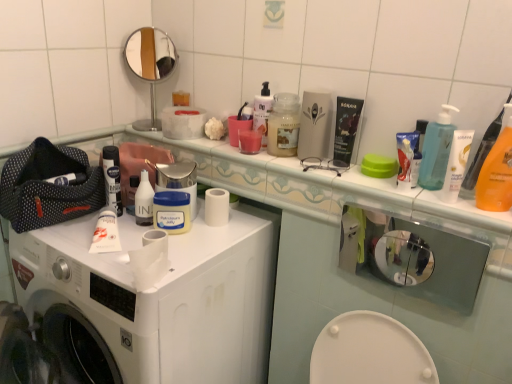
This screenshot has height=384, width=512. Find the location of `free location in front of black matte tube at upper center, the first product from the left`. free location in front of black matte tube at upper center, the first product from the left is located at coordinates (368, 182).